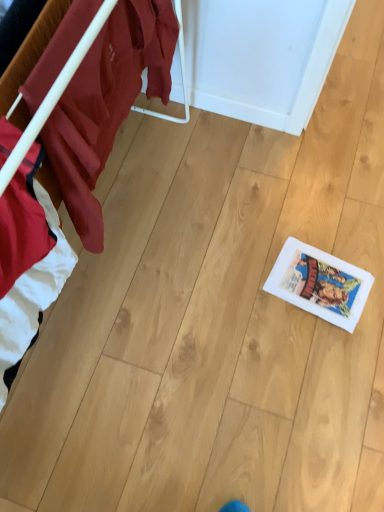
Where is `empty space that is ontop of white paper comic book at lower right (from a real-world perspective)`? This screenshot has width=384, height=512. empty space that is ontop of white paper comic book at lower right (from a real-world perspective) is located at coordinates (323, 280).